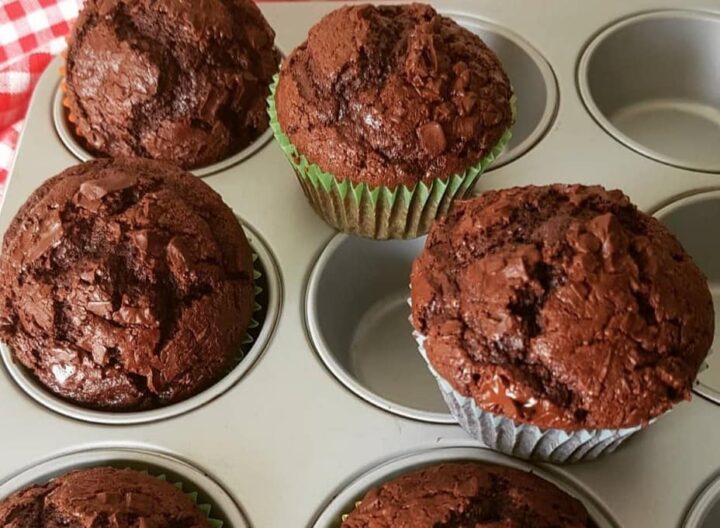
The height and width of the screenshot is (528, 720). In order to click on red and white checkers towel in this screenshot , I will do `click(53, 42)`.